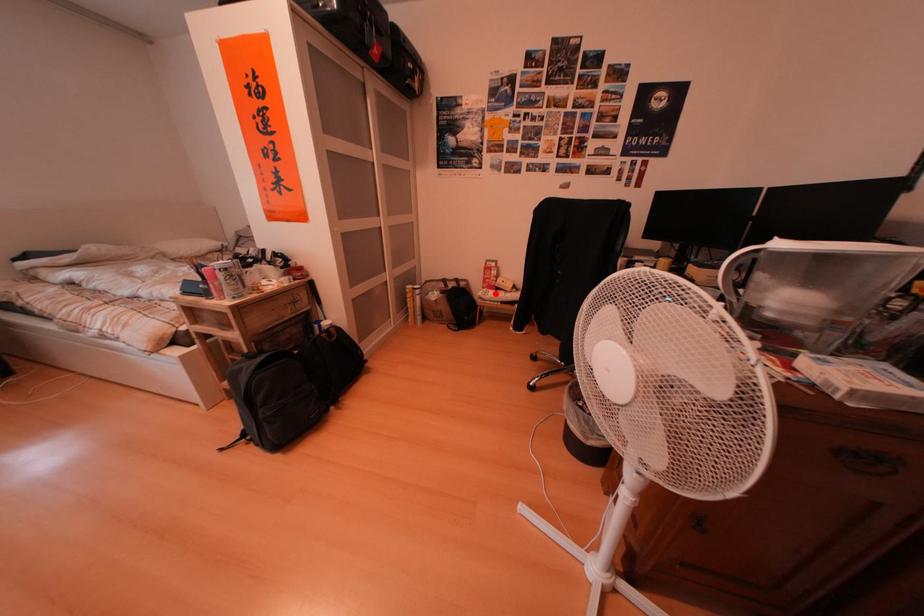
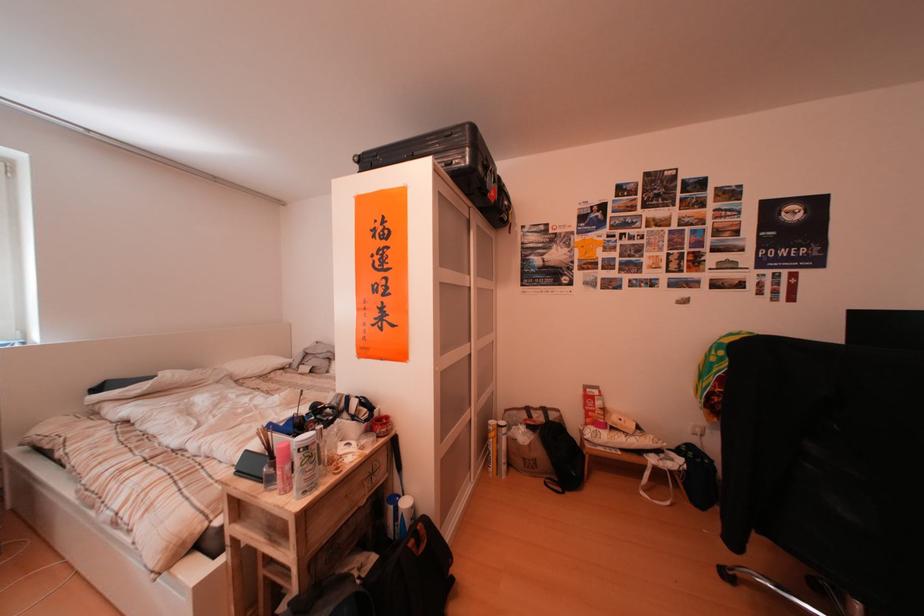
Question: I am providing you with two images of the same scene from different viewpoints. Given a red point in image1, look at the same physical point in image2. Is it:

Choices:
 (A) Closer to the viewpoint
 (B) Farther from the viewpoint

Answer: (B)